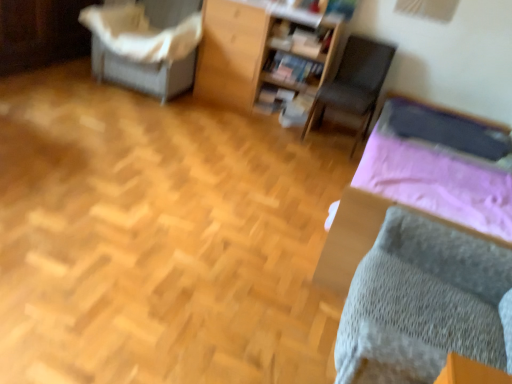
Question: From the image's perspective, is wooden bookshelf at upper center, the 1th furniture from the right, located above or below white fabric-covered chair at upper left, the 2th furniture in the right-to-left sequence?

Choices:
 (A) above
 (B) below

Answer: (B)

Question: Which is correct: wooden bookshelf at upper center, arranged as the second furniture when viewed from the left, is inside white fabric-covered chair at upper left, which is counted as the first furniture, starting from the left, or outside of it?

Choices:
 (A) inside
 (B) outside

Answer: (B)

Question: Estimate the real-world distances between objects in this image. Which object is farther from the gray knitted bed at lower right?

Choices:
 (A) dark gray fabric chair at center
 (B) matte wooden bookshelf at center
 (C) wooden bookshelf at upper center, arranged as the second furniture when viewed from the left
 (D) white fabric-covered chair at upper left, which is counted as the first furniture, starting from the left

Answer: (D)

Question: Which of these objects is positioned farthest from the matte wooden bookshelf at center?

Choices:
 (A) gray knitted bed at lower right
 (B) dark gray fabric chair at center
 (C) white fabric-covered chair at upper left, the 2th furniture in the right-to-left sequence
 (D) wooden bookshelf at upper center, arranged as the second furniture when viewed from the left

Answer: (A)